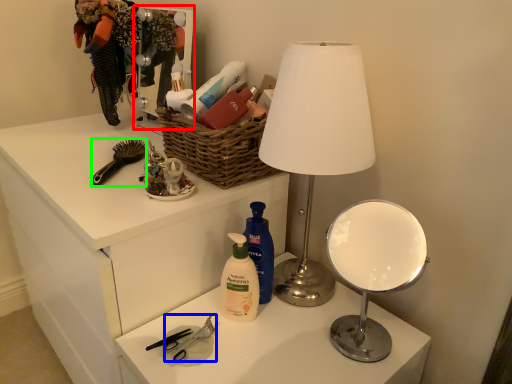
Question: Which object is the farthest from mirror (highlighted by a red box)? Choose among these: scissors (highlighted by a blue box) or brush (highlighted by a green box).

Choices:
 (A) scissors
 (B) brush

Answer: (A)